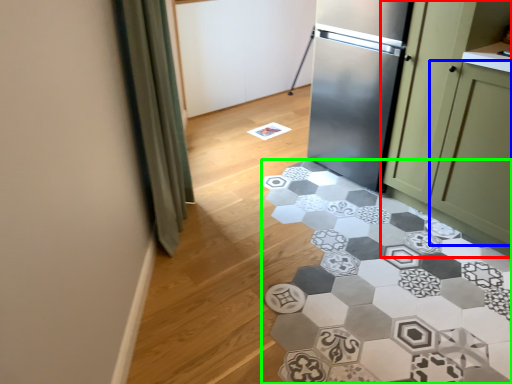
Question: Estimate the real-world distances between objects in this image. Which object is farther from cabinetry (highlighted by a red box), glass door (highlighted by a blue box) or marble (highlighted by a green box)?

Choices:
 (A) glass door
 (B) marble

Answer: (B)